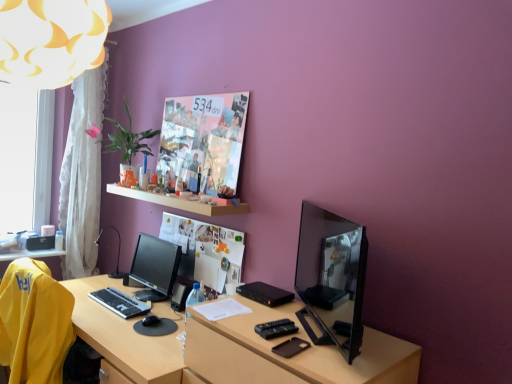
Question: From a real-world perspective, is black plastic keyboard at lower left physically below satin black monitor at center, arranged as the first computer monitor when viewed from the left?

Choices:
 (A) yes
 (B) no

Answer: (A)

Question: Considering the relative sizes of black plastic keyboard at lower left and satin black monitor at center, the second computer monitor positioned from the right, in the image provided, is black plastic keyboard at lower left thinner than satin black monitor at center, the second computer monitor positioned from the right,?

Choices:
 (A) yes
 (B) no

Answer: (A)

Question: Can you confirm if black plastic keyboard at lower left is shorter than satin black monitor at center, which is the 1th computer monitor from back to front?

Choices:
 (A) yes
 (B) no

Answer: (A)

Question: Is black plastic keyboard at lower left with satin black monitor at center, which is the 1th computer monitor from back to front?

Choices:
 (A) yes
 (B) no

Answer: (B)

Question: From a real-world perspective, is black plastic keyboard at lower left positioned over satin black monitor at center, which is the 1th computer monitor from back to front, based on gravity?

Choices:
 (A) no
 (B) yes

Answer: (A)

Question: Is black plastic keyboard at lower left facing away from satin black monitor at center, the second computer monitor positioned from the right?

Choices:
 (A) no
 (B) yes

Answer: (B)

Question: Is there a large distance between transparent glass window at left and white wooden shelf at upper center?

Choices:
 (A) yes
 (B) no

Answer: (A)

Question: Is transparent glass window at left not inside white wooden shelf at upper center?

Choices:
 (A) no
 (B) yes

Answer: (B)

Question: Is white wooden shelf at upper center surrounded by transparent glass window at left?

Choices:
 (A) no
 (B) yes

Answer: (A)

Question: Is transparent glass window at left oriented towards white wooden shelf at upper center?

Choices:
 (A) yes
 (B) no

Answer: (B)

Question: Does transparent glass window at left have a larger size compared to white wooden shelf at upper center?

Choices:
 (A) yes
 (B) no

Answer: (A)

Question: Can you confirm if transparent glass window at left is wider than white wooden shelf at upper center?

Choices:
 (A) no
 (B) yes

Answer: (A)

Question: Can you confirm if yellow fabric chair at lower left is positioned to the left of transparent glass window at left?

Choices:
 (A) yes
 (B) no

Answer: (B)